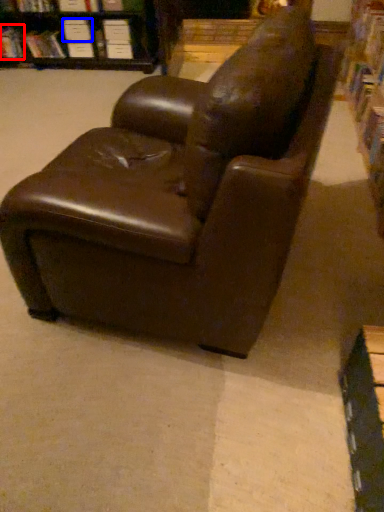
Question: Among these objects, which one is nearest to the camera, book (highlighted by a red box) or paperback book (highlighted by a blue box)?

Choices:
 (A) book
 (B) paperback book

Answer: (B)